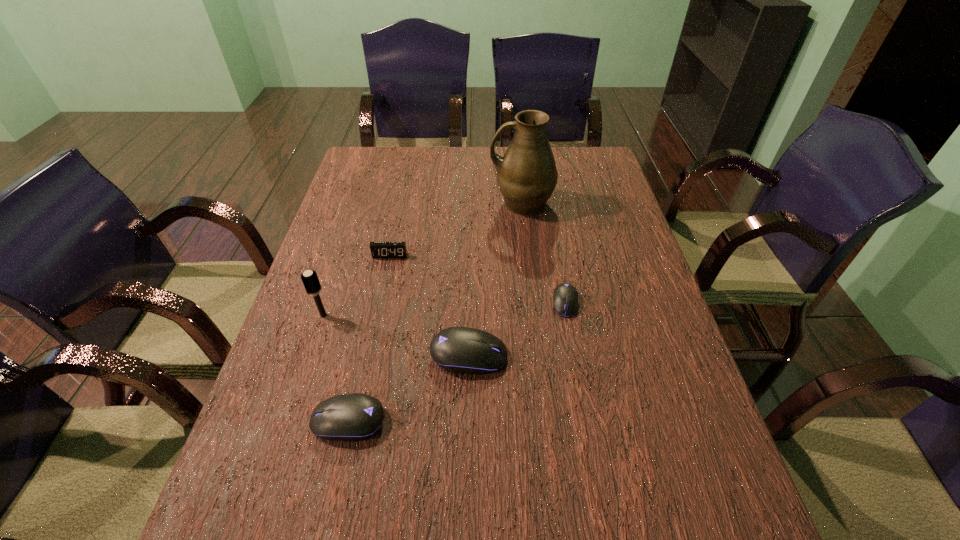
Please point a free position for a computer mouse on the right. Please provide its 2D coordinates. Your answer should be formatted as a tuple, i.e. [(x, y)], where the tuple contains the x and y coordinates of a point satisfying the conditions above.

[(643, 260)]